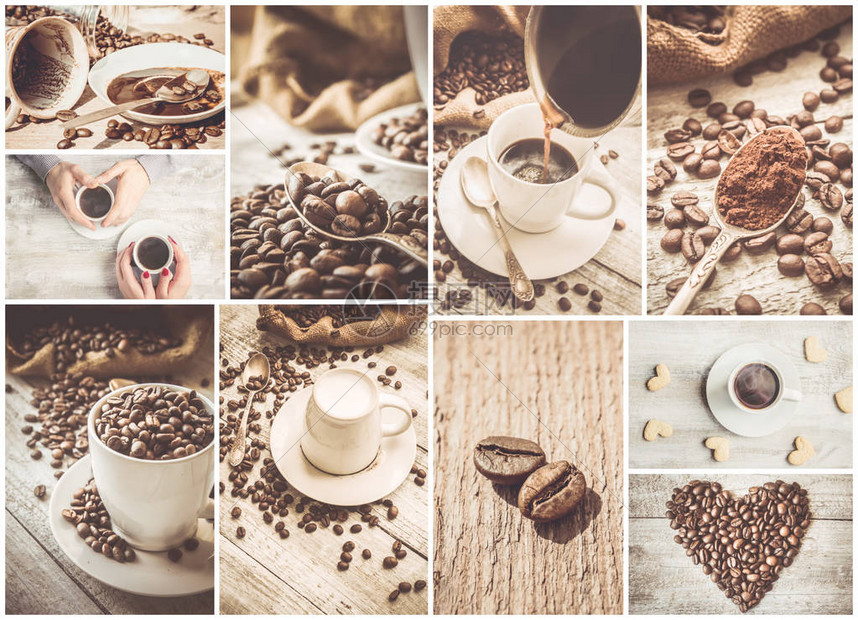
The height and width of the screenshot is (620, 858). In order to click on coffee cup in this screenshot , I will do `click(141, 467)`, `click(333, 412)`, `click(751, 374)`, `click(533, 188)`, `click(155, 249)`, `click(88, 195)`, `click(41, 61)`.